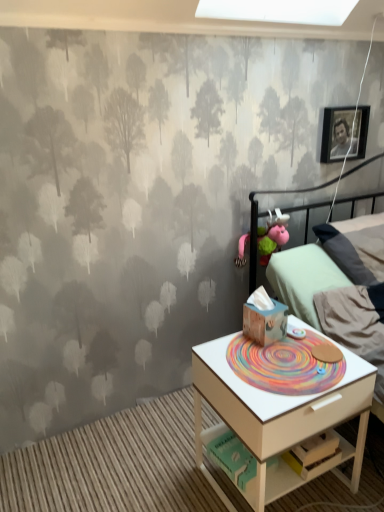
Question: Which direction should I rotate to look at wooden tissue box at center, marked as the 2th toy in a top-to-bottom arrangement?

Choices:
 (A) left
 (B) right

Answer: (B)

Question: Is matte black picture frame at upper right at the back of white wood drawer at lower right?

Choices:
 (A) yes
 (B) no

Answer: (B)

Question: Is the depth of white wood drawer at lower right greater than that of matte black picture frame at upper right?

Choices:
 (A) no
 (B) yes

Answer: (A)

Question: Is white wood drawer at lower right surrounding matte black picture frame at upper right?

Choices:
 (A) yes
 (B) no

Answer: (B)

Question: From a real-world perspective, is white wood drawer at lower right on top of matte black picture frame at upper right?

Choices:
 (A) yes
 (B) no

Answer: (B)

Question: Is white wood drawer at lower right positioned before matte black picture frame at upper right?

Choices:
 (A) yes
 (B) no

Answer: (A)

Question: Considering the relative sizes of white wood drawer at lower right and matte black picture frame at upper right in the image provided, is white wood drawer at lower right wider than matte black picture frame at upper right?

Choices:
 (A) yes
 (B) no

Answer: (A)

Question: Is white wood drawer at lower right aimed at white wood nightstand at lower right?

Choices:
 (A) yes
 (B) no

Answer: (A)

Question: From the image's perspective, is white wood drawer at lower right below white wood nightstand at lower right?

Choices:
 (A) no
 (B) yes

Answer: (B)

Question: Does white wood drawer at lower right have a greater width compared to white wood nightstand at lower right?

Choices:
 (A) no
 (B) yes

Answer: (A)

Question: Can you confirm if white wood drawer at lower right is thinner than white wood nightstand at lower right?

Choices:
 (A) no
 (B) yes

Answer: (B)

Question: Does white wood drawer at lower right come behind white wood nightstand at lower right?

Choices:
 (A) no
 (B) yes

Answer: (B)

Question: Does white wood drawer at lower right lie in front of white wood nightstand at lower right?

Choices:
 (A) yes
 (B) no

Answer: (B)

Question: Is light green fabric bed at right at the left side of white wood nightstand at lower right?

Choices:
 (A) yes
 (B) no

Answer: (B)